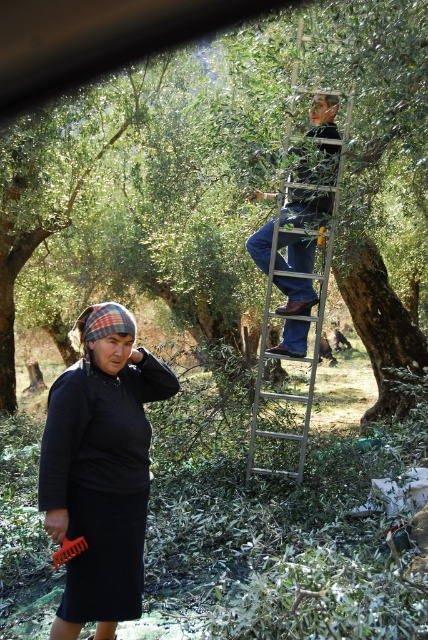
Can you confirm if green leafy tree at upper center is wider than silver metallic ladder at upper center?

Indeed, green leafy tree at upper center has a greater width compared to silver metallic ladder at upper center.

Identify the location of green leafy tree at upper center. The height and width of the screenshot is (640, 428). (97, 38).

Between point (20, 93) and point (279, 396), which one is positioned in front?

Point (279, 396)

I want to click on green leafy tree at upper center, so click(x=97, y=38).

Between dark gray knit hat at lower left and green leafy tree at upper center, which one has more height?

Standing taller between the two is green leafy tree at upper center.

Who is positioned more to the right, dark gray knit hat at lower left or green leafy tree at upper center?

green leafy tree at upper center

Who is more distant from viewer, (x=103, y=380) or (x=253, y=8)?

Point (x=253, y=8)

Locate an element on the screen. The height and width of the screenshot is (640, 428). dark gray knit hat at lower left is located at coordinates (101, 468).

Does green leafy tree at upper center have a greater width compared to orange plastic comb at lower left?

Indeed, green leafy tree at upper center has a greater width compared to orange plastic comb at lower left.

Does green leafy tree at upper center appear on the right side of orange plastic comb at lower left?

Correct, you'll find green leafy tree at upper center to the right of orange plastic comb at lower left.

Locate an element on the screen. Image resolution: width=428 pixels, height=640 pixels. green leafy tree at upper center is located at coordinates (97, 38).

Identify the location of green leafy tree at upper center. (97, 38).